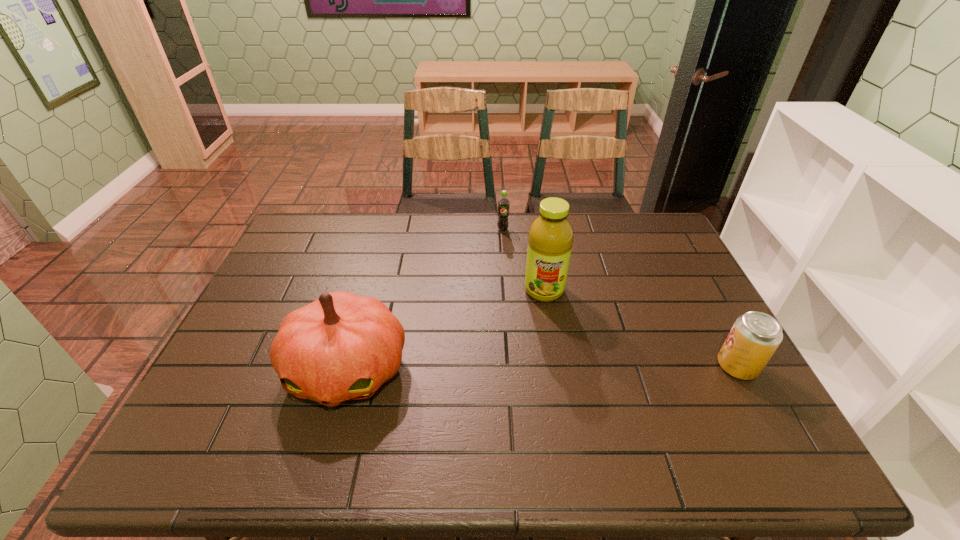
Find the location of a particular element. empty space that is in between the farther soda and the third object from left to right is located at coordinates (523, 260).

This screenshot has height=540, width=960. I want to click on vacant area that lies between the farther soda and the second tallest object, so click(425, 300).

Identify which object is the second closest to the second farthest object. Please provide its 2D coordinates. Your answer should be formatted as a tuple, i.e. [(x, y)], where the tuple contains the x and y coordinates of a point satisfying the conditions above.

[(341, 347)]

Point out which object is positioned as the second nearest to the left soda. Please provide its 2D coordinates. Your answer should be formatted as a tuple, i.e. [(x, y)], where the tuple contains the x and y coordinates of a point satisfying the conditions above.

[(341, 347)]

This screenshot has width=960, height=540. In order to click on vacant area that satisfies the following two spatial constraints: 1. on the front side of the farthest object; 2. on the left side of the fruit juice in this screenshot , I will do `click(507, 291)`.